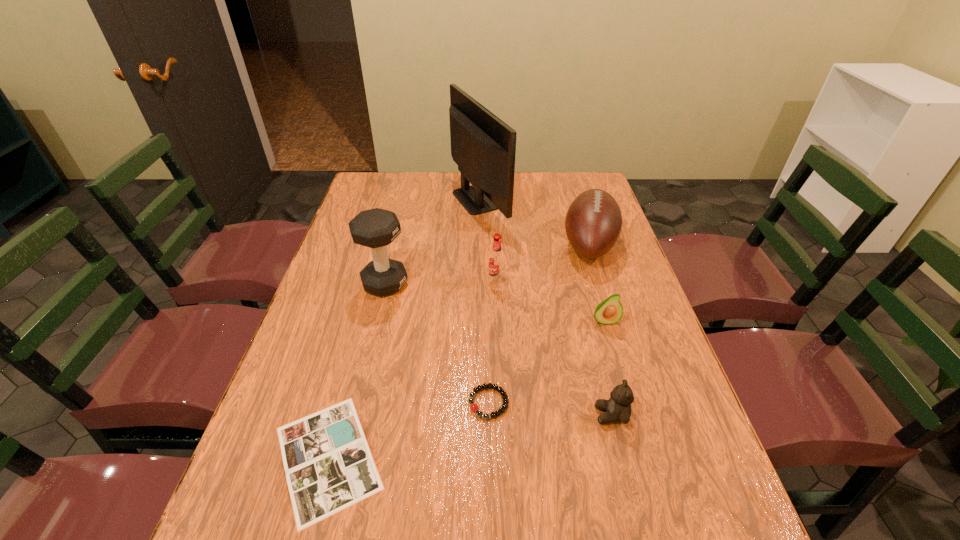
Identify the location of the tallest object. (483, 146).

The height and width of the screenshot is (540, 960). What are the coordinates of `the seventh shortest object` in the screenshot? It's located at (376, 228).

Find the location of `football (American)`. football (American) is located at coordinates (593, 222).

This screenshot has height=540, width=960. I want to click on root beer, so click(496, 259).

Find the location of a particular element. This screenshot has width=960, height=540. avocado is located at coordinates (609, 311).

The height and width of the screenshot is (540, 960). Find the location of `teddy bear`. teddy bear is located at coordinates (618, 408).

Image resolution: width=960 pixels, height=540 pixels. What are the coordinates of `bracelet` in the screenshot? It's located at (499, 389).

What are the coordinates of `book` in the screenshot? It's located at (329, 466).

Locate an element on the screen. free location located 0.270m on the front-facing side of the computer monitor is located at coordinates (583, 199).

At what (x,y) coordinates should I click in order to perform the action: click on vacant space situated 0.320m on the right of the seventh shortest object. Please return your answer as a coordinate pair (x, y). Looking at the image, I should click on (520, 284).